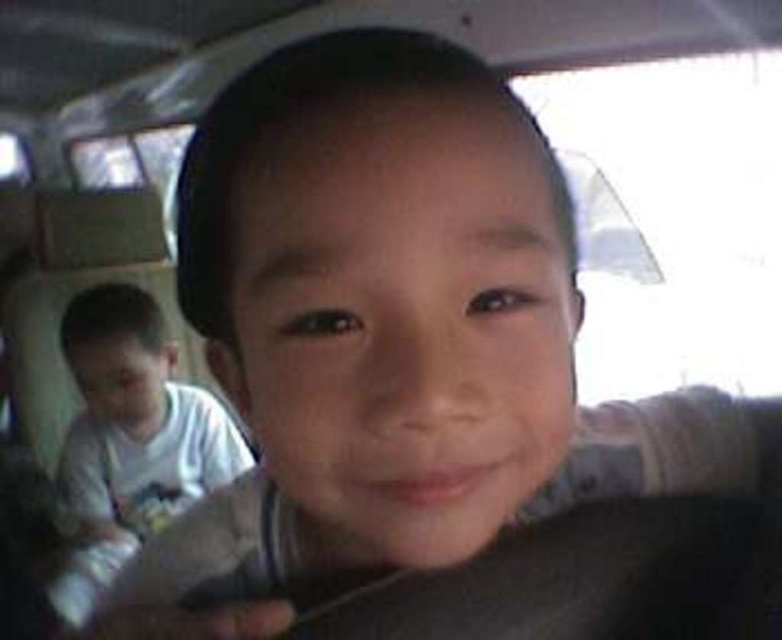
You are a passenger in the vehicle and want to look outside through the transparent plastic car window at upper right. Where exactly should you look to see through it?

A: The transparent plastic car window at upper right is located at point (673, 218), so you should look towards that coordinate to see through it.